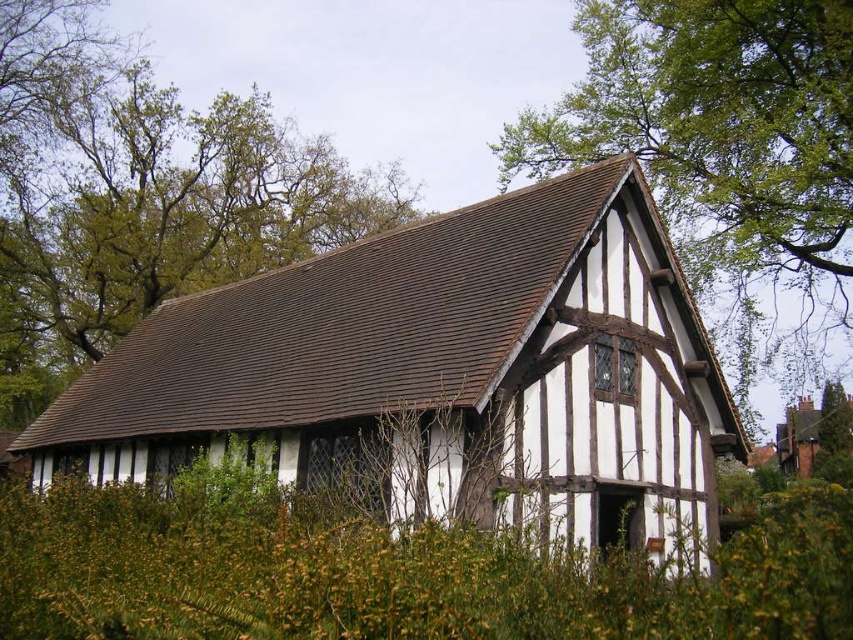
You are an architect assessing the building for restoration. You notice two green leafy trees in the image. Which tree is closer to the building, the green leafy tree at upper center or the green leafy tree at upper right?

The green leafy tree at upper center is closer to the building because it is smaller than the green leafy tree at upper right, which is larger and thus farther away.

You are a painter planning to capture the scene of the traditional half timbered building surrounded by green leafy trees. You want to ensure the trees are proportionally accurate in your painting. Which tree should you paint as narrower between the green leafy tree at upper center and the green leafy tree at upper right?

The green leafy tree at upper center should be painted as narrower since its width is less than the green leafy tree at upper right.

You are standing in front of the traditional half timbered building and notice two green leafy trees in the upper part of the image. Which tree is closer to the building, the green leafy tree at upper center or the green leafy tree at upper right?

The green leafy tree at upper center is closer to the building because it is positioned over the green leafy tree at upper right, meaning it is in front of it.